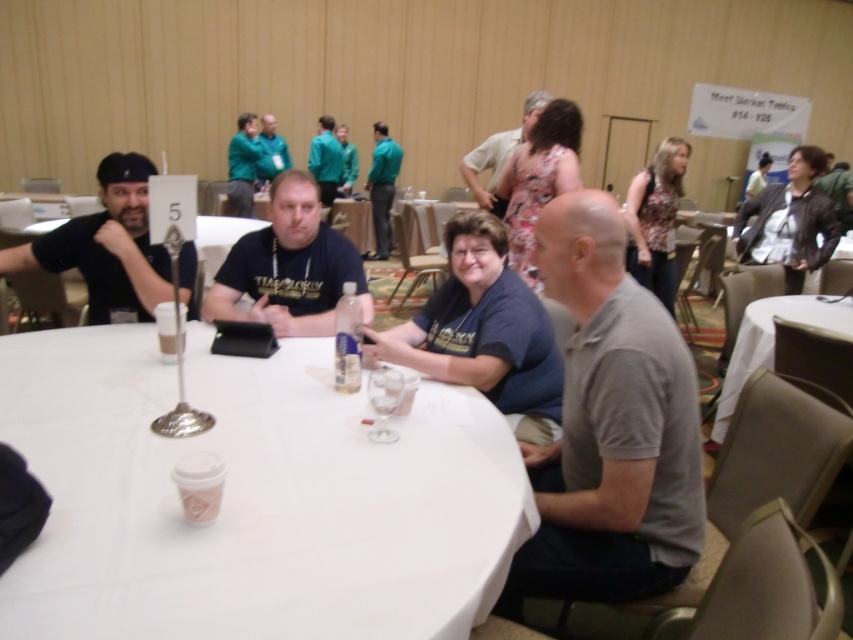
Who is positioned more to the left, gray cotton polo shirt at center or matte black t-shirt at left?

matte black t-shirt at left is more to the left.

Describe the element at coordinates (610, 428) in the screenshot. The image size is (853, 640). I see `gray cotton polo shirt at center` at that location.

Between point (659, 378) and point (129, 154), which one is positioned in front?

Point (659, 378) is more forward.

Find the location of `gray cotton polo shirt at center`. gray cotton polo shirt at center is located at coordinates (610, 428).

Which is more to the right, white matte table at center or matte black t-shirt at center?

Positioned to the right is matte black t-shirt at center.

Between point (44, 593) and point (318, 250), which one is positioned behind?

The point (318, 250) is behind.

Between point (410, 488) and point (328, 253), which one is positioned in front?

Positioned in front is point (410, 488).

Where is `white matte table at center`? This screenshot has width=853, height=640. white matte table at center is located at coordinates (250, 497).

Does matte black t-shirt at center have a smaller size compared to green matte shirt at upper center?

No.

Is point (311, 202) farther from viewer compared to point (271, 173)?

No, it is in front of (271, 173).

At what (x,y) coordinates should I click in order to perform the action: click on matte black t-shirt at center. Please return your answer as a coordinate pair (x, y). Looking at the image, I should click on (289, 266).